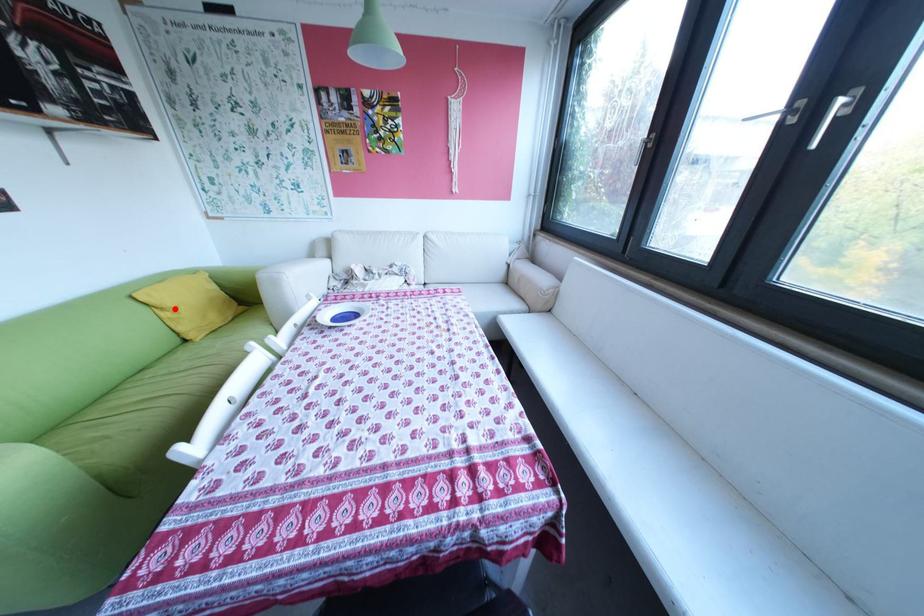
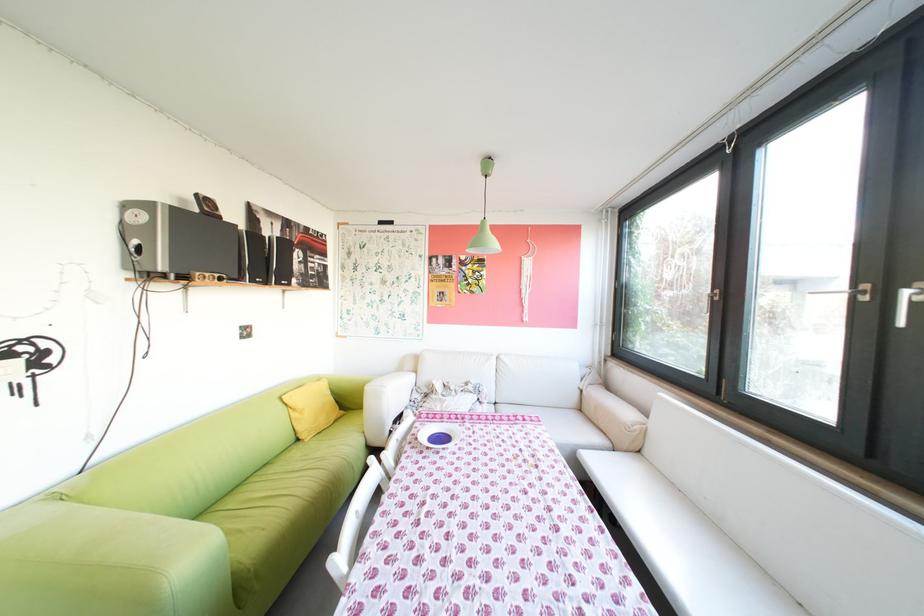
Locate, in the second image, the point that corresponds to the highlighted location in the first image.

(307, 410)